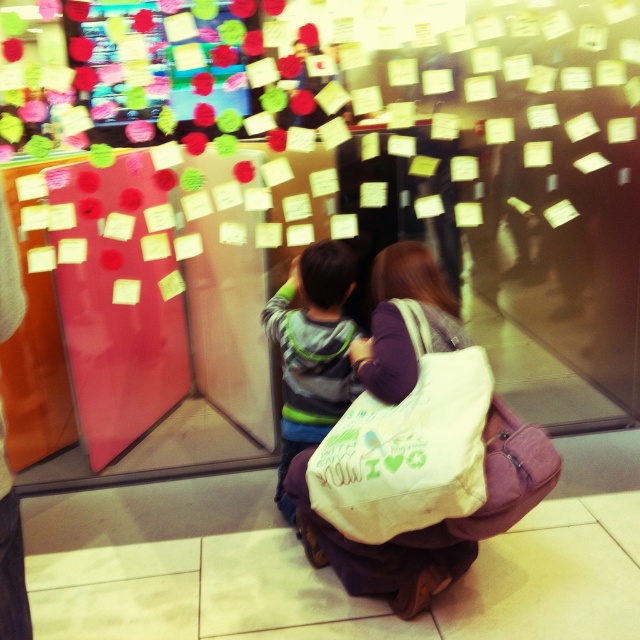
Question: Is white canvas tote at center closer to the viewer compared to striped sweater at center?

Choices:
 (A) yes
 (B) no

Answer: (A)

Question: Which point appears closest to the camera in this image?

Choices:
 (A) (269, 332)
 (B) (355, 474)

Answer: (B)

Question: Which object is farther from the camera taking this photo?

Choices:
 (A) white canvas tote at center
 (B) striped sweater at center

Answer: (B)

Question: Observing the image, what is the correct spatial positioning of white canvas tote at center in reference to striped sweater at center?

Choices:
 (A) right
 (B) left

Answer: (A)

Question: Which point is farther from the camera taking this photo?

Choices:
 (A) (436, 438)
 (B) (326, 420)

Answer: (B)

Question: Does white canvas tote at center appear on the right side of striped sweater at center?

Choices:
 (A) yes
 (B) no

Answer: (A)